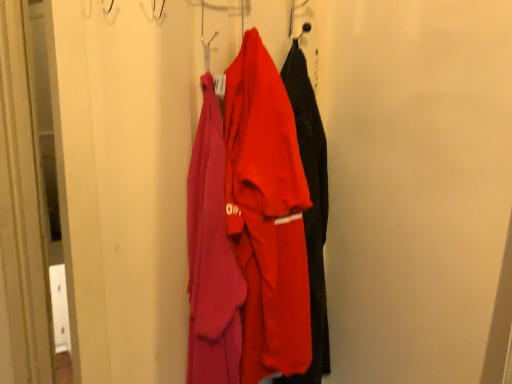
What are the coordinates of `matte red towel at center` in the screenshot? It's located at [x=267, y=216].

Describe the element at coordinates (267, 216) in the screenshot. The width and height of the screenshot is (512, 384). I see `matte red towel at center` at that location.

Locate an element on the screen. Image resolution: width=512 pixels, height=384 pixels. matte red towel at center is located at coordinates (267, 216).